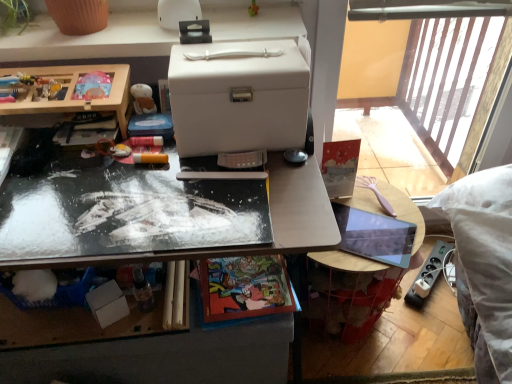
Question: Should I look upward or downward to see white matte box at center?

Choices:
 (A) up
 (B) down

Answer: (A)

Question: Considering the relative sizes of wooden toy box at left, which is counted as the 2th desk, starting from the bottom, and white plastic storage box at upper center, the first desk viewed from the top, in the image provided, is wooden toy box at left, which is counted as the 2th desk, starting from the bottom, wider than white plastic storage box at upper center, the first desk viewed from the top,?

Choices:
 (A) yes
 (B) no

Answer: (B)

Question: Could you tell me if wooden toy box at left, which is counted as the 2th desk, starting from the bottom, is facing white plastic storage box at upper center, the first desk viewed from the top?

Choices:
 (A) yes
 (B) no

Answer: (B)

Question: Considering the relative sizes of wooden toy box at left, which is counted as the 2th desk, starting from the bottom, and white plastic storage box at upper center, placed as the third desk when sorted from bottom to top, in the image provided, is wooden toy box at left, which is counted as the 2th desk, starting from the bottom, thinner than white plastic storage box at upper center, placed as the third desk when sorted from bottom to top,?

Choices:
 (A) no
 (B) yes

Answer: (B)

Question: Can white plastic storage box at upper center, placed as the third desk when sorted from bottom to top, be found inside wooden toy box at left, the 2th desk positioned from the top?

Choices:
 (A) no
 (B) yes

Answer: (A)

Question: Is wooden toy box at left, the 2th desk positioned from the top, shorter than white plastic storage box at upper center, placed as the third desk when sorted from bottom to top?

Choices:
 (A) no
 (B) yes

Answer: (A)

Question: Is the depth of wooden toy box at left, which is counted as the 2th desk, starting from the bottom, greater than that of white plastic storage box at upper center, the first desk viewed from the top?

Choices:
 (A) no
 (B) yes

Answer: (A)

Question: Is the position of smooth wooden table at right more distant than that of metallic reflective desk at center, which appears as the 3th desk when viewed from the top?

Choices:
 (A) no
 (B) yes

Answer: (B)

Question: Considering the relative sizes of smooth wooden table at right and metallic reflective desk at center, which is counted as the first desk, starting from the bottom, in the image provided, is smooth wooden table at right smaller than metallic reflective desk at center, which is counted as the first desk, starting from the bottom,?

Choices:
 (A) no
 (B) yes

Answer: (B)

Question: Is smooth wooden table at right oriented towards metallic reflective desk at center, which is counted as the first desk, starting from the bottom?

Choices:
 (A) no
 (B) yes

Answer: (A)

Question: Is smooth wooden table at right wider than metallic reflective desk at center, which is counted as the first desk, starting from the bottom?

Choices:
 (A) yes
 (B) no

Answer: (B)

Question: Does smooth wooden table at right have a lesser width compared to metallic reflective desk at center, which is counted as the first desk, starting from the bottom?

Choices:
 (A) yes
 (B) no

Answer: (A)

Question: Is smooth wooden table at right at the right side of metallic reflective desk at center, which appears as the 3th desk when viewed from the top?

Choices:
 (A) yes
 (B) no

Answer: (A)

Question: Considering the relative positions of metallic reflective desk at center, which appears as the 3th desk when viewed from the top, and smooth wooden table at right in the image provided, is metallic reflective desk at center, which appears as the 3th desk when viewed from the top, to the left of smooth wooden table at right from the viewer's perspective?

Choices:
 (A) yes
 (B) no

Answer: (A)